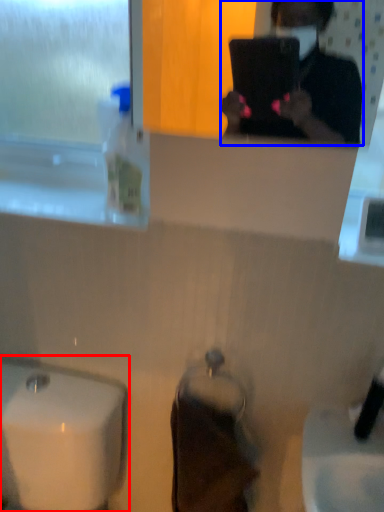
Question: Among these objects, which one is farthest to the camera, sink (highlighted by a red box) or person (highlighted by a blue box)?

Choices:
 (A) sink
 (B) person

Answer: (A)